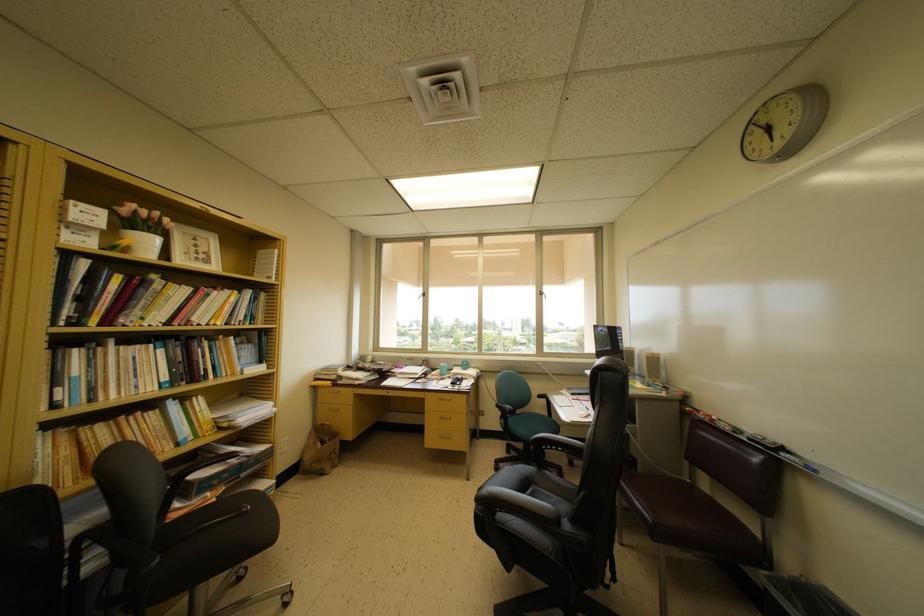
What do you see at coordinates (529, 424) in the screenshot? This screenshot has width=924, height=616. I see `the grey chair sitting surface` at bounding box center [529, 424].